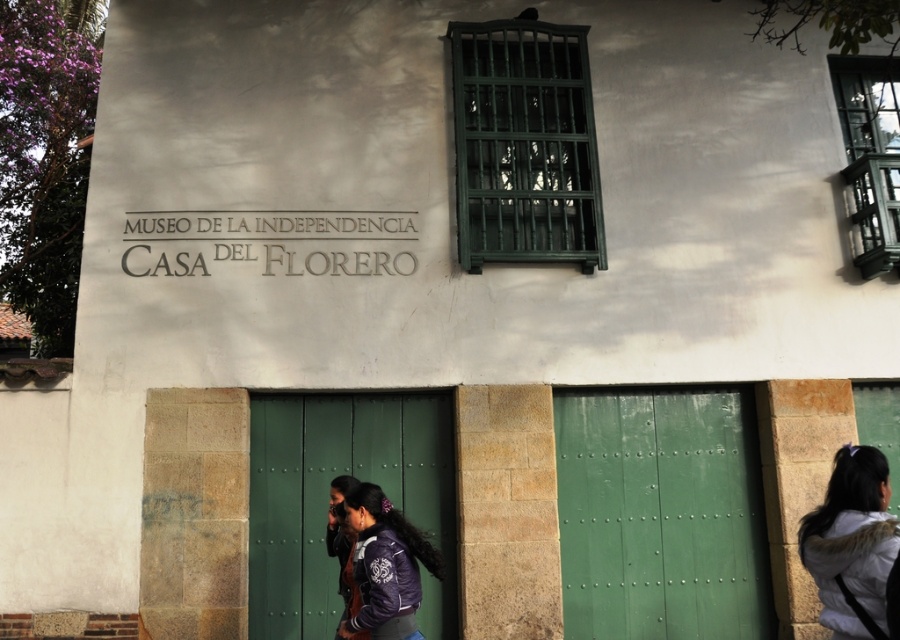
Describe the element at coordinates (851, 541) in the screenshot. The height and width of the screenshot is (640, 900). I see `white fuzzy jacket at lower right` at that location.

Between white fuzzy jacket at lower right and dark purple jacket at center, which one appears on the left side from the viewer's perspective?

From the viewer's perspective, dark purple jacket at center appears more on the left side.

Who is more distant from viewer, (831, 483) or (346, 552)?

The point (346, 552) is behind.

At what (x,y) coordinates should I click in order to perform the action: click on white fuzzy jacket at lower right. Please return your answer as a coordinate pair (x, y). The image size is (900, 640). Looking at the image, I should click on (851, 541).

Which of these two, purple matte jacket at center or dark purple jacket at center, stands shorter?

With less height is dark purple jacket at center.

What are the coordinates of `purple matte jacket at center` in the screenshot? It's located at (387, 564).

Is point (388, 620) closer to viewer compared to point (330, 529)?

Yes, point (388, 620) is closer to viewer.

This screenshot has width=900, height=640. What are the coordinates of `purple matte jacket at center` in the screenshot? It's located at (387, 564).

Can you confirm if white fuzzy jacket at lower right is taller than purple matte jacket at center?

In fact, white fuzzy jacket at lower right may be shorter than purple matte jacket at center.

Where is `white fuzzy jacket at lower right`? Image resolution: width=900 pixels, height=640 pixels. white fuzzy jacket at lower right is located at coordinates (851, 541).